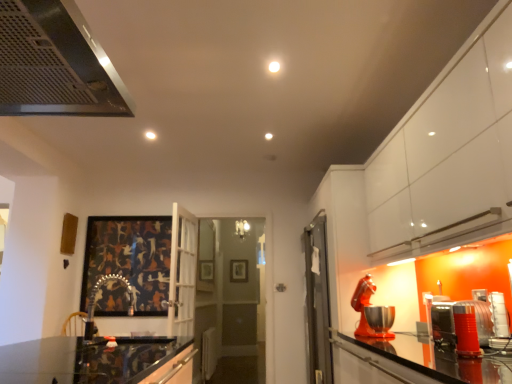
Question: Looking at their shapes, would you say wooden picture frame at center, which appears as the 2th picture frame when viewed from the left, is wider or thinner than dark matte painting at center, positioned as the first picture frame in front-to-back order?

Choices:
 (A) thin
 (B) wide

Answer: (A)

Question: Does point (240, 279) appear closer or farther from the camera than point (108, 314)?

Choices:
 (A) farther
 (B) closer

Answer: (A)

Question: Considering the real-world distances, which object is closest to the rubberized orange blender at right, placed as the fourth appliance when sorted from back to front?

Choices:
 (A) wooden picture frame at center, placed as the 1th picture frame when sorted from bottom to top
 (B) dark matte painting at center, positioned as the first picture frame in front-to-back order
 (C) metallic silver toaster at right, placed as the fourth appliance when sorted from front to back
 (D) metallic mesh at upper left
 (E) shiny metallic mixer at right, placed as the second appliance when sorted from back to front

Answer: (C)

Question: Which object is positioned closest to the metallic mesh at upper left?

Choices:
 (A) rubberized orange blender at right, placed as the fourth appliance when sorted from back to front
 (B) metallic silver toaster at right, positioned as the 1th appliance in back-to-front order
 (C) dark matte painting at center, the second picture frame from the back
 (D) wooden picture frame at center, which appears as the 2th picture frame when viewed from the left
 (E) shiny metallic mixer at right, marked as the third appliance in a front-to-back arrangement

Answer: (A)